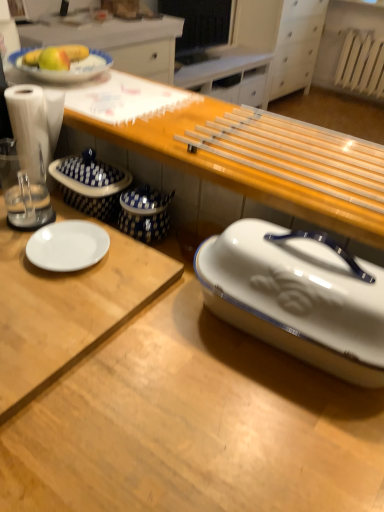
Question: Looking at the image, does white glossy plate at left, the 1th desk positioned from the top, seem bigger or smaller compared to transparent plastic blender at left?

Choices:
 (A) small
 (B) big

Answer: (B)

Question: From the image's perspective, is white glossy plate at left, the 1th desk positioned from the top, positioned above or below transparent plastic blender at left?

Choices:
 (A) above
 (B) below

Answer: (B)

Question: Which object is positioned farthest from the white glossy desk at center, the 2th desk in the top-to-bottom sequence?

Choices:
 (A) white plastic radiator at upper right
 (B) wooden table at center
 (C) white glossy plate at left, which is the 2th desk from bottom to top
 (D) yellow matte apple at upper left
 (E) white glossy breadbox at lower right

Answer: (A)

Question: Which of these objects is positioned closest to the white glossy desk at center, the 2th desk in the top-to-bottom sequence?

Choices:
 (A) white glossy plate at left, which is the 2th desk from bottom to top
 (B) transparent plastic blender at left
 (C) white glossy breadbox at lower right
 (D) white plastic radiator at upper right
 (E) yellow matte apple at upper left

Answer: (A)